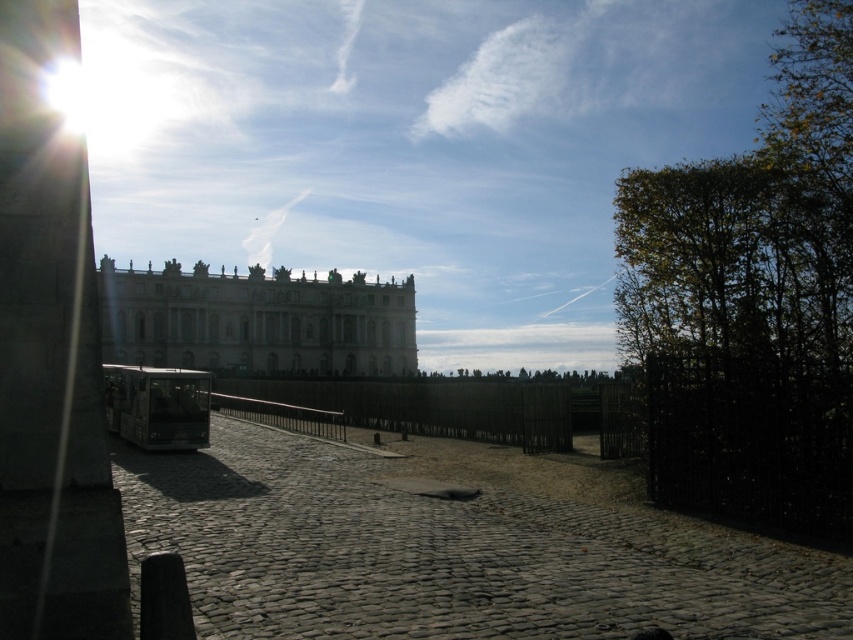
Question: Which object appears closest to the camera in this image?

Choices:
 (A) metallic bus at center
 (B) green leafy tree at right
 (C) white stone building at center

Answer: (A)

Question: Can you confirm if green leafy tree at right is positioned above white stone building at center?

Choices:
 (A) no
 (B) yes

Answer: (B)

Question: Which point is closer to the camera?

Choices:
 (A) (701, 352)
 (B) (148, 310)

Answer: (A)

Question: Among these points, which one is nearest to the camera?

Choices:
 (A) (177, 442)
 (B) (718, 513)
 (C) (279, 282)

Answer: (B)

Question: Does green leafy tree at right have a larger size compared to white stone building at center?

Choices:
 (A) yes
 (B) no

Answer: (A)

Question: Can you confirm if green leafy tree at right is positioned to the left of metallic bus at center?

Choices:
 (A) no
 (B) yes

Answer: (A)